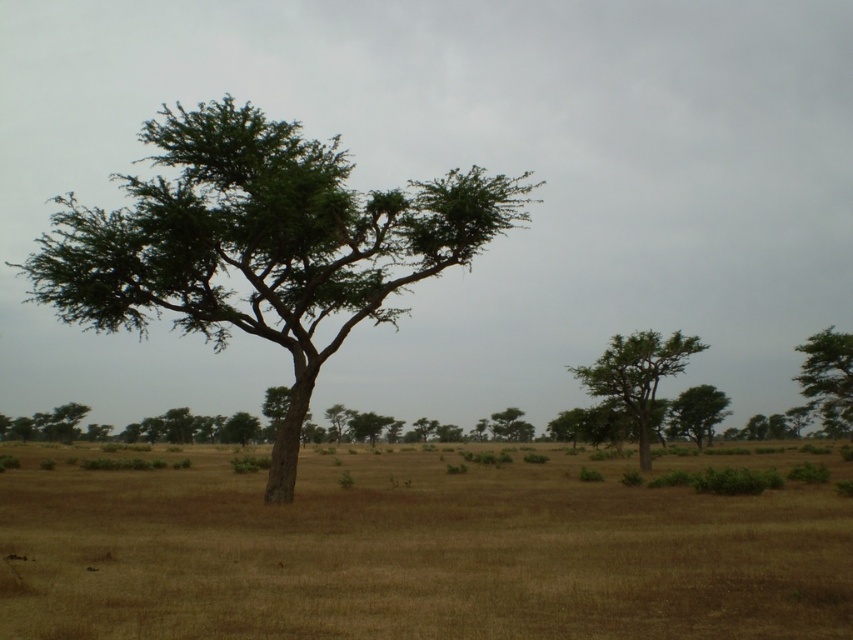
Does green leafy tree at center lie in front of green leafy tree at center-right?

Yes, green leafy tree at center is in front of green leafy tree at center-right.

Describe the element at coordinates (260, 244) in the screenshot. I see `green leafy tree at center` at that location.

Where is `green leafy tree at center`? green leafy tree at center is located at coordinates (260, 244).

Who is shorter, green leafy tree at center or green rough bark tree at right?

green rough bark tree at right

Locate an element on the screen. This screenshot has width=853, height=640. green leafy tree at center is located at coordinates (260, 244).

Locate an element on the screen. The width and height of the screenshot is (853, 640). green leafy tree at center is located at coordinates (260, 244).

Does green rough bark tree at right have a lesser width compared to green leafy tree at center-right?

Correct, green rough bark tree at right's width is less than green leafy tree at center-right's.

Which is more to the right, green rough bark tree at right or green leafy tree at center-right?

From the viewer's perspective, green leafy tree at center-right appears more on the right side.

Identify the location of green rough bark tree at right. (637, 378).